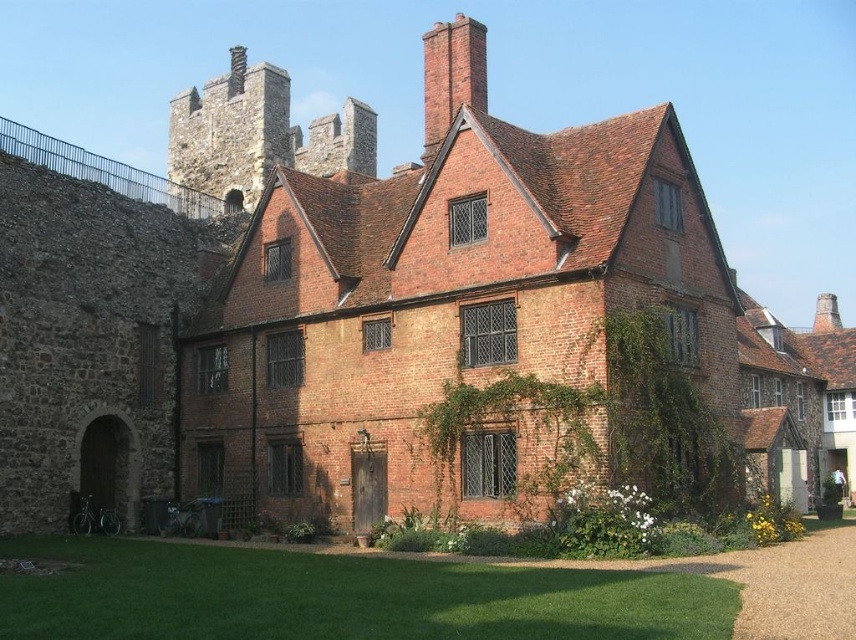
Who is taller, green grass at lower center or stone brick tower at upper left?

stone brick tower at upper left

Between point (648, 582) and point (187, 90), which one is positioned behind?

Positioned behind is point (187, 90).

Which is behind, point (278, 621) or point (210, 161)?

The point (210, 161) is more distant.

Identify the location of green grass at lower center. (337, 596).

Who is lower down, green grass at lower center or brick chimney at upper center?

Positioned lower is green grass at lower center.

Where is `green grass at lower center`? The height and width of the screenshot is (640, 856). green grass at lower center is located at coordinates (337, 596).

In the scene shown: Is stone brick tower at upper left to the right of brick chimney at upper center from the viewer's perspective?

Incorrect, stone brick tower at upper left is not on the right side of brick chimney at upper center.

At what (x,y) coordinates should I click in order to perform the action: click on stone brick tower at upper left. Please return your answer as a coordinate pair (x, y). The width and height of the screenshot is (856, 640). Looking at the image, I should click on (x=257, y=134).

I want to click on stone brick tower at upper left, so click(257, 134).